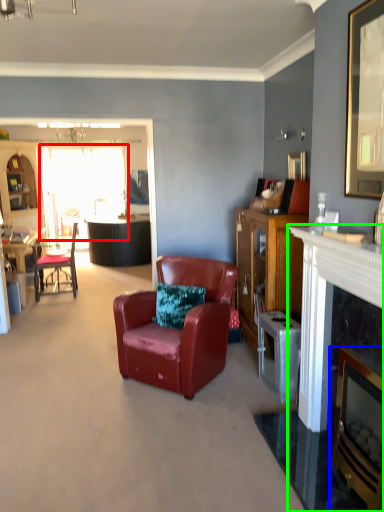
Question: Which object is the closest to the glass door (highlighted by a red box)? Choose among these: fireplace (highlighted by a blue box) or fireplace (highlighted by a green box).

Choices:
 (A) fireplace
 (B) fireplace

Answer: (B)